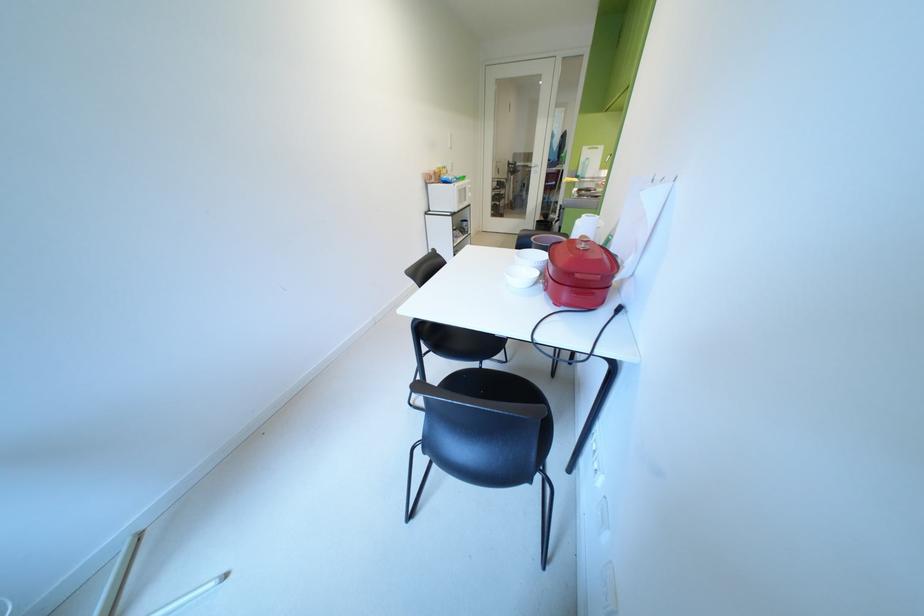
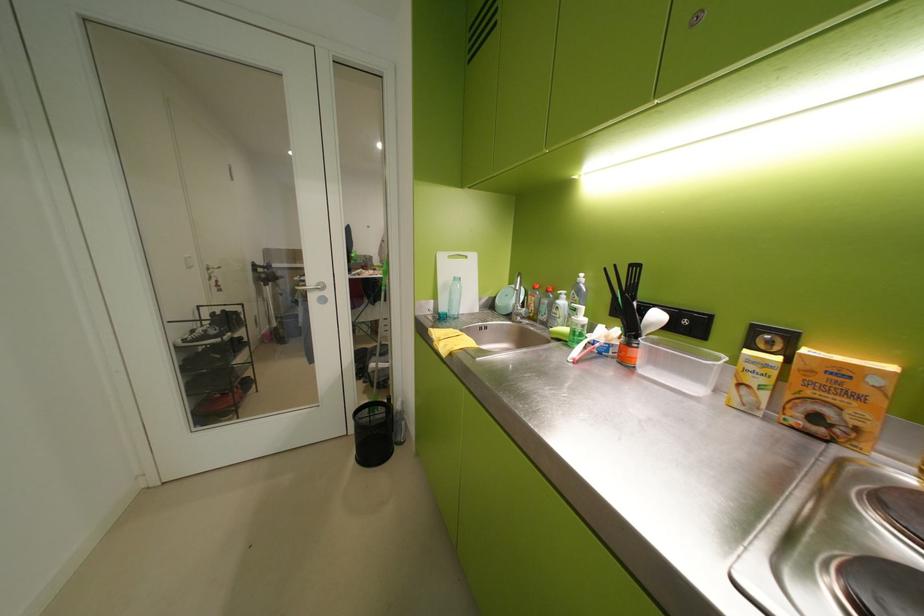
Where in the second image is the point corresponding to (x=594, y=150) from the first image?

(453, 259)